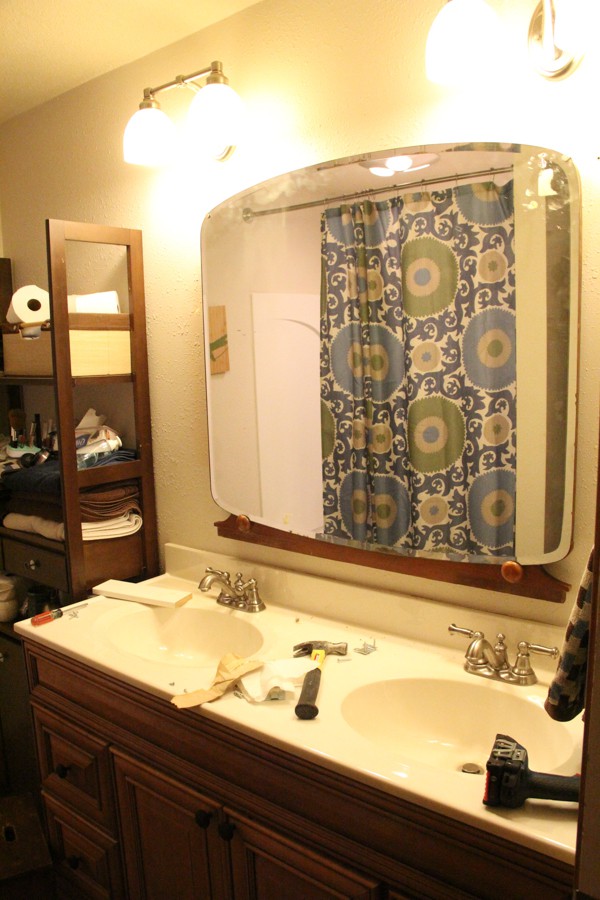
The height and width of the screenshot is (900, 600). Identify the location of shelves. (84, 320), (117, 469).